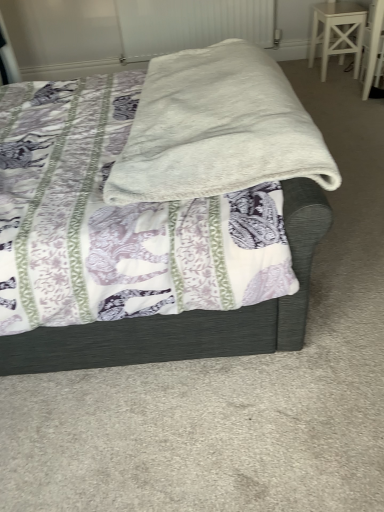
Question: Is white textured radiator at upper center positioned with its back to white soft blanket at center?

Choices:
 (A) no
 (B) yes

Answer: (A)

Question: Can you confirm if white textured radiator at upper center is thinner than white soft blanket at center?

Choices:
 (A) no
 (B) yes

Answer: (B)

Question: Would you say white textured radiator at upper center is a long distance from white soft blanket at center?

Choices:
 (A) yes
 (B) no

Answer: (A)

Question: Is white textured radiator at upper center taller than white soft blanket at center?

Choices:
 (A) yes
 (B) no

Answer: (B)

Question: Are white textured radiator at upper center and white soft blanket at center making contact?

Choices:
 (A) yes
 (B) no

Answer: (B)

Question: Looking at their shapes, would you say white soft blanket at center is wider or thinner than white soft blanket at center?

Choices:
 (A) thin
 (B) wide

Answer: (A)

Question: In terms of height, does white soft blanket at center look taller or shorter compared to white soft blanket at center?

Choices:
 (A) tall
 (B) short

Answer: (B)

Question: Looking at the image, does white soft blanket at center seem bigger or smaller compared to white soft blanket at center?

Choices:
 (A) big
 (B) small

Answer: (B)

Question: From the image's perspective, is white soft blanket at center located above or below white soft blanket at center?

Choices:
 (A) above
 (B) below

Answer: (A)

Question: From a real-world perspective, is white textured radiator at upper center physically located above or below white painted wood stool at upper right?

Choices:
 (A) below
 (B) above

Answer: (B)

Question: Considering the positions of point (241, 35) and point (312, 48), is point (241, 35) closer or farther from the camera than point (312, 48)?

Choices:
 (A) farther
 (B) closer

Answer: (B)

Question: In terms of height, does white textured radiator at upper center look taller or shorter compared to white painted wood stool at upper right?

Choices:
 (A) short
 (B) tall

Answer: (B)

Question: From the image's perspective, is white textured radiator at upper center positioned above or below white painted wood stool at upper right?

Choices:
 (A) below
 (B) above

Answer: (B)

Question: Relative to white soft blanket at center, is white textured radiator at upper center in front or behind?

Choices:
 (A) front
 (B) behind

Answer: (B)

Question: From a real-world perspective, is white textured radiator at upper center physically located above or below white soft blanket at center?

Choices:
 (A) below
 (B) above

Answer: (A)